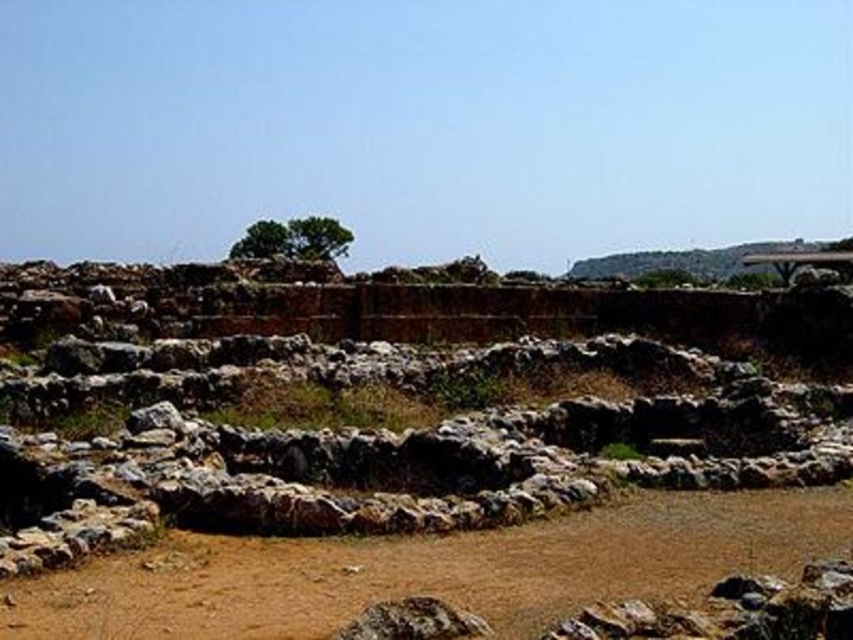
Consider the image. Does brown dirt field at lower center appear on the left side of green leafy tree at center?

In fact, brown dirt field at lower center is to the right of green leafy tree at center.

Who is more forward, (285, 580) or (305, 227)?

Point (285, 580)

Which is behind, point (590, 538) or point (303, 250)?

Point (303, 250)

Where is `brown dirt field at lower center`? This screenshot has width=853, height=640. brown dirt field at lower center is located at coordinates (430, 570).